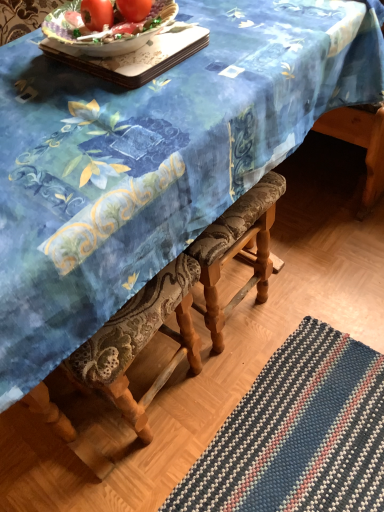
Question: Is matte red tomato at upper center, the 1th tomato in the right-to-left sequence, shorter than porcelain tray at upper center?

Choices:
 (A) yes
 (B) no

Answer: (B)

Question: From the image's perspective, is matte red tomato at upper center, the 1th tomato in the right-to-left sequence, under porcelain tray at upper center?

Choices:
 (A) yes
 (B) no

Answer: (B)

Question: Can you confirm if matte red tomato at upper center, the 1th tomato in the right-to-left sequence, is taller than porcelain tray at upper center?

Choices:
 (A) yes
 (B) no

Answer: (A)

Question: Is the depth of matte red tomato at upper center, the 1th tomato in the right-to-left sequence, less than that of porcelain tray at upper center?

Choices:
 (A) yes
 (B) no

Answer: (B)

Question: Could you tell me if matte red tomato at upper center, the 1th tomato in the right-to-left sequence, is facing porcelain tray at upper center?

Choices:
 (A) no
 (B) yes

Answer: (A)

Question: Considering their positions, is porcelain tray at upper center located in front of or behind matte red tomato at upper center, which ranks as the second tomato in right-to-left order?

Choices:
 (A) front
 (B) behind

Answer: (A)

Question: Is porcelain tray at upper center wider or thinner than matte red tomato at upper center, marked as the first tomato in a left-to-right arrangement?

Choices:
 (A) thin
 (B) wide

Answer: (B)

Question: From a real-world perspective, relative to matte red tomato at upper center, which ranks as the second tomato in right-to-left order, is porcelain tray at upper center vertically above or below?

Choices:
 (A) below
 (B) above

Answer: (A)

Question: From the image's perspective, is porcelain tray at upper center located above or below matte red tomato at upper center, which ranks as the second tomato in right-to-left order?

Choices:
 (A) below
 (B) above

Answer: (A)

Question: Is matte red tomato at upper center, marked as the first tomato in a left-to-right arrangement, bigger or smaller than matte red tomato at upper center, the 1th tomato in the right-to-left sequence?

Choices:
 (A) small
 (B) big

Answer: (B)

Question: Would you say matte red tomato at upper center, marked as the first tomato in a left-to-right arrangement, is to the left or to the right of matte red tomato at upper center, the second tomato when ordered from left to right, in the picture?

Choices:
 (A) left
 (B) right

Answer: (A)

Question: Choose the correct answer: Is matte red tomato at upper center, which ranks as the second tomato in right-to-left order, inside matte red tomato at upper center, the 1th tomato in the right-to-left sequence, or outside it?

Choices:
 (A) inside
 (B) outside

Answer: (B)

Question: From the image's perspective, is matte red tomato at upper center, marked as the first tomato in a left-to-right arrangement, located above or below matte red tomato at upper center, the 1th tomato in the right-to-left sequence?

Choices:
 (A) above
 (B) below

Answer: (B)

Question: In terms of size, does porcelain tray at upper center appear bigger or smaller than matte red tomato at upper center, the 1th tomato in the right-to-left sequence?

Choices:
 (A) small
 (B) big

Answer: (B)

Question: In terms of height, does porcelain tray at upper center look taller or shorter compared to matte red tomato at upper center, the second tomato when ordered from left to right?

Choices:
 (A) tall
 (B) short

Answer: (B)